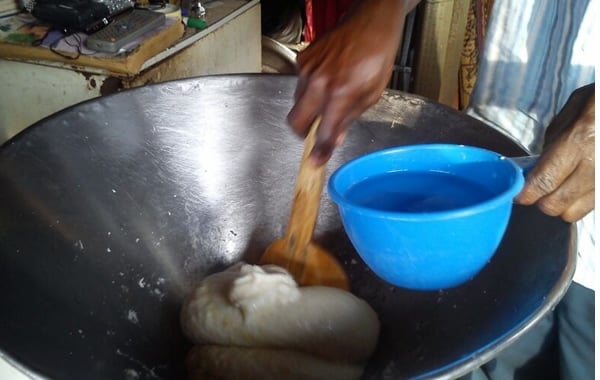
This screenshot has height=380, width=600. Identify the location of natural wood of nasty table. (214, 41).